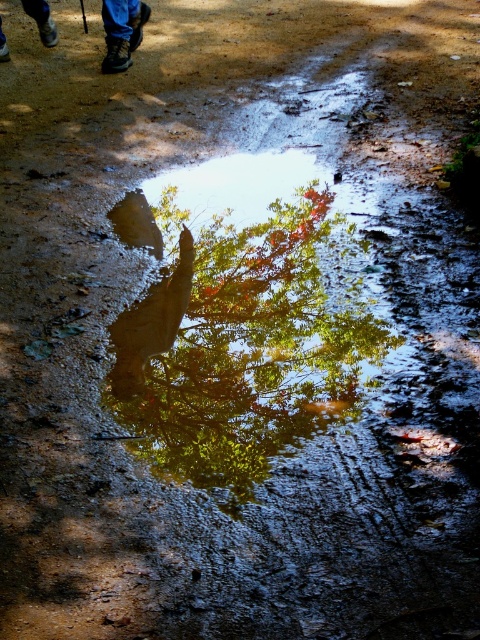
Is green glossy tree at center thinner than blue jeans at upper left?

No, green glossy tree at center is not thinner than blue jeans at upper left.

Locate an element on the screen. The height and width of the screenshot is (640, 480). green glossy tree at center is located at coordinates (242, 323).

Which is behind, point (251, 493) or point (45, 40)?

The point (45, 40) is behind.

Find the location of a particular element. The height and width of the screenshot is (640, 480). green glossy tree at center is located at coordinates (242, 323).